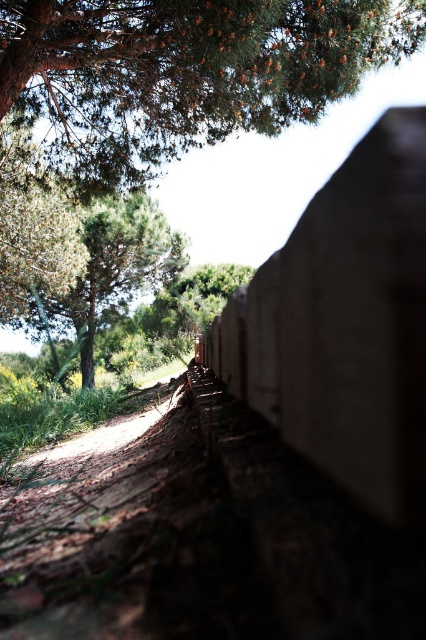
You are standing at the center of the dirt path in the midground and want to locate the green textured pine tree at upper left. According to the coordinates provided, in which direction should you look to find it?

The green textured pine tree at upper left is located at point 0.113 on the x axis and 0.434 on the y axis. Since the x coordinate is on the left side of the image and the y coordinate is towards the top, you should look to your upper left direction to find it.

You are standing on the dirt path and looking towards the background. Which tree, the green textured pine tree at upper left or the green leafy tree at upper left, is positioned more to the right?

The green textured pine tree at upper left is positioned more to the right compared to the green leafy tree at upper left.

You are standing at the point labeled as point (184,72) in the image. Looking around, you notice a green textured pine tree at upper left. Based on your position, which direction should you walk to reach the green textured pine tree at upper left?

The green textured pine tree at upper left is located at the point (184,72), which is your current position. Therefore, you are already at the location of the green textured pine tree at upper left and do not need to move.